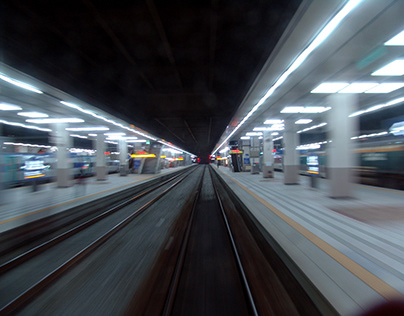
In order to click on column in this screenshot , I will do `click(65, 165)`, `click(102, 161)`, `click(123, 155)`, `click(344, 166)`, `click(292, 168)`, `click(268, 166)`, `click(253, 166)`, `click(246, 161)`.